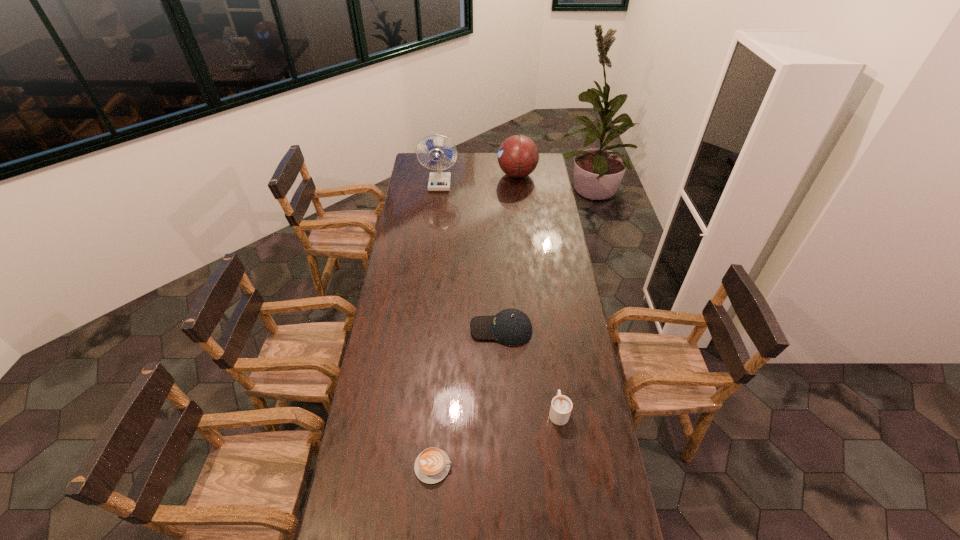
You are a GUI agent. You are given a task and a screenshot of the screen. Output one action in this format:
    pyautogui.click(x=<x>, y=<y>)
    Task: Click on the vacant space in between the fourth shortest object and the fan
    
    Given the screenshot: What is the action you would take?
    pyautogui.click(x=478, y=179)

Find the location of a particular element. The height and width of the screenshot is (540, 960). free space between the nearest object and the third nearest object is located at coordinates (468, 398).

Image resolution: width=960 pixels, height=540 pixels. Find the location of `vacant point located between the second nearest object and the shorter cappuccino`. vacant point located between the second nearest object and the shorter cappuccino is located at coordinates (495, 439).

Image resolution: width=960 pixels, height=540 pixels. I want to click on empty space that is in between the third farthest object and the shortest object, so click(x=468, y=398).

This screenshot has width=960, height=540. Find the location of `the closest object to the nearer cappuccino`. the closest object to the nearer cappuccino is located at coordinates (561, 406).

The height and width of the screenshot is (540, 960). Identify the location of object that is the second closest one to the shortest object. (512, 327).

Identify the location of free space that satisfies the following two spatial constraints: 1. on the side with the handle of the farther cappuccino; 2. on the front-facing side of the baseball cap. [547, 329].

Find the location of a particular element. This screenshot has height=540, width=960. free location that satisfies the following two spatial constraints: 1. on the side with the handle of the farther cappuccino; 2. on the front-facing side of the baseball cap is located at coordinates (547, 329).

In order to click on vacant space that satisfies the following two spatial constraints: 1. on the front side of the basketball; 2. on the side of the nearest object with the handle in this screenshot , I will do `click(549, 466)`.

Identify the location of vacant area in the image that satisfies the following two spatial constraints: 1. on the front-facing side of the third farthest object; 2. on the side with the handle of the taller cappuccino. (505, 412).